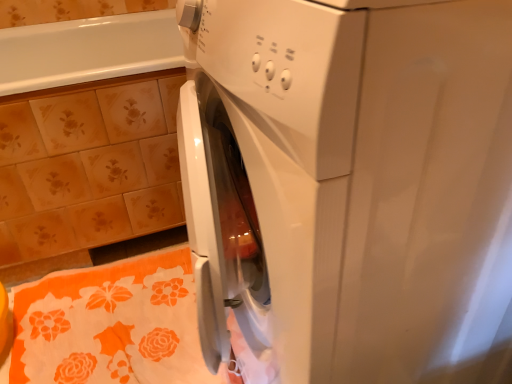
Question: From a real-world perspective, is floral ceramic tile at upper left above or below orange floral bath towel at lower left?

Choices:
 (A) above
 (B) below

Answer: (A)

Question: Is floral ceramic tile at upper left inside the boundaries of orange floral bath towel at lower left, or outside?

Choices:
 (A) outside
 (B) inside

Answer: (A)

Question: Which is farther from the white glossy washing machine at center?

Choices:
 (A) orange floral bath towel at lower left
 (B) floral ceramic tile at upper left

Answer: (B)

Question: Estimate the real-world distances between objects in this image. Which object is farther from the floral ceramic tile at upper left?

Choices:
 (A) white glossy washing machine at center
 (B) orange floral bath towel at lower left

Answer: (A)